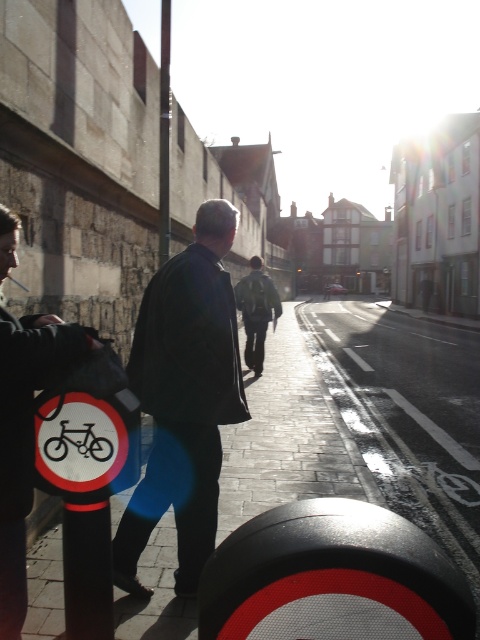
Can you confirm if dark matte jacket at center is thinner than metallic pole at center?

Correct, dark matte jacket at center's width is less than metallic pole at center's.

Who is taller, dark matte jacket at center or metallic pole at center?

With more height is metallic pole at center.

Where is `dark matte jacket at center`? Image resolution: width=480 pixels, height=640 pixels. dark matte jacket at center is located at coordinates (183, 397).

Consider the image. Does black asphalt pavement at lower left have a larger size compared to metallic silver bicycle at center?

Indeed, black asphalt pavement at lower left has a larger size compared to metallic silver bicycle at center.

Can you confirm if black asphalt pavement at lower left is wider than metallic silver bicycle at center?

Yes.

Describe the element at coordinates (287, 436) in the screenshot. This screenshot has height=640, width=480. I see `black asphalt pavement at lower left` at that location.

You are a GUI agent. You are given a task and a screenshot of the screen. Output one action in this format:
    pyautogui.click(x=<x>, y=<y>)
    Task: Click on the black asphalt pavement at lower left
    The image size is (480, 640).
    Given the screenshot: What is the action you would take?
    pyautogui.click(x=287, y=436)

Is the position of black asphalt pavement at lower left less distant than that of dark blue jacket at left?

That is False.

Between point (247, 428) and point (1, 621), which one is positioned in front?

Point (1, 621)

Find the location of a particular element. Image resolution: width=480 pixels, height=640 pixels. black asphalt pavement at lower left is located at coordinates (287, 436).